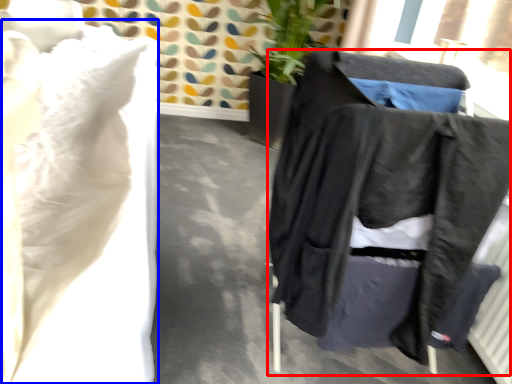
Question: Which of the following is the closest to the observer, furniture (highlighted by a red box) or sheet (highlighted by a blue box)?

Choices:
 (A) furniture
 (B) sheet

Answer: (B)